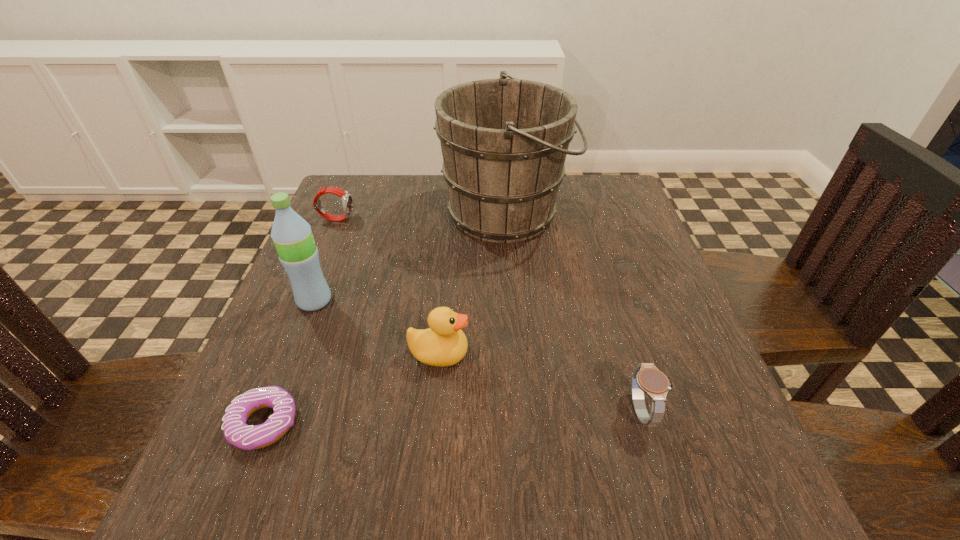
Locate an element on the screen. This screenshot has width=960, height=540. vacant space located 0.160m at the beak of the duck is located at coordinates (561, 354).

What are the coordinates of `vacant space located on the face of the left watch` in the screenshot? It's located at click(x=465, y=219).

Locate an element on the screen. vacant region located on the right of the nearer watch is located at coordinates (696, 411).

Locate an element on the screen. vacant space located 0.150m on the right of the shortest object is located at coordinates (396, 423).

Locate an element on the screen. bucket present at the far edge is located at coordinates (504, 142).

In order to click on watch located at the far edge in this screenshot , I will do `click(347, 202)`.

At what (x,y) coordinates should I click in order to perform the action: click on water bottle that is at the left edge. Please return your answer as a coordinate pair (x, y). This screenshot has width=960, height=540. Looking at the image, I should click on (292, 236).

The image size is (960, 540). What are the coordinates of `watch at the left edge` in the screenshot? It's located at (x=347, y=202).

Find the location of a particular element. This screenshot has height=540, width=960. doughnut that is at the left edge is located at coordinates (236, 431).

Identify the location of bucket situated at the right edge. (504, 142).